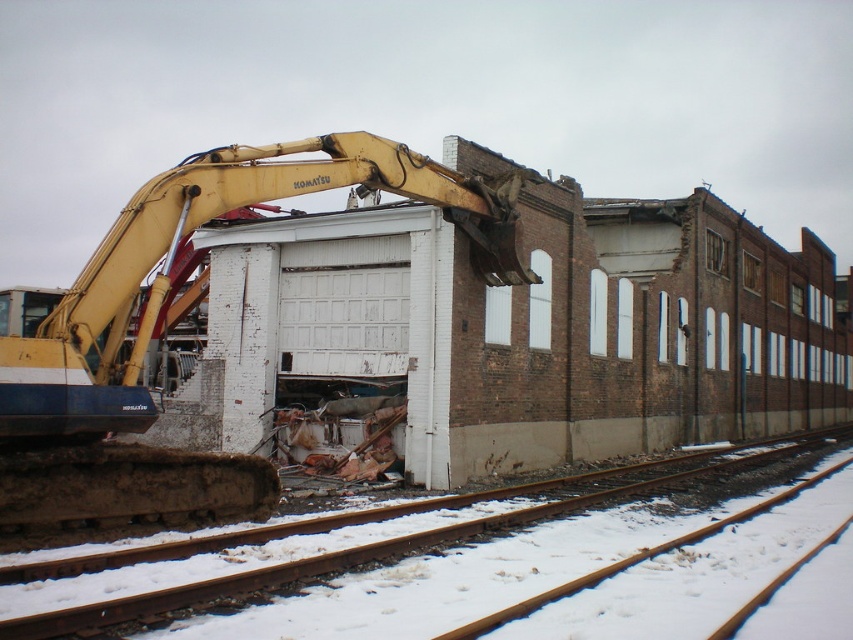
You are a construction worker standing at the point labeled point [378,563]. You need to move to the KOMATSU excavator. Which direction should you walk to reach it?

The point [378,563] is on snow covered metal tracks at lower left. The KOMATSU excavator is actively engaged in dismantling a section of a brick building. Therefore, you should walk towards the brick building to reach the KOMATSU excavator.